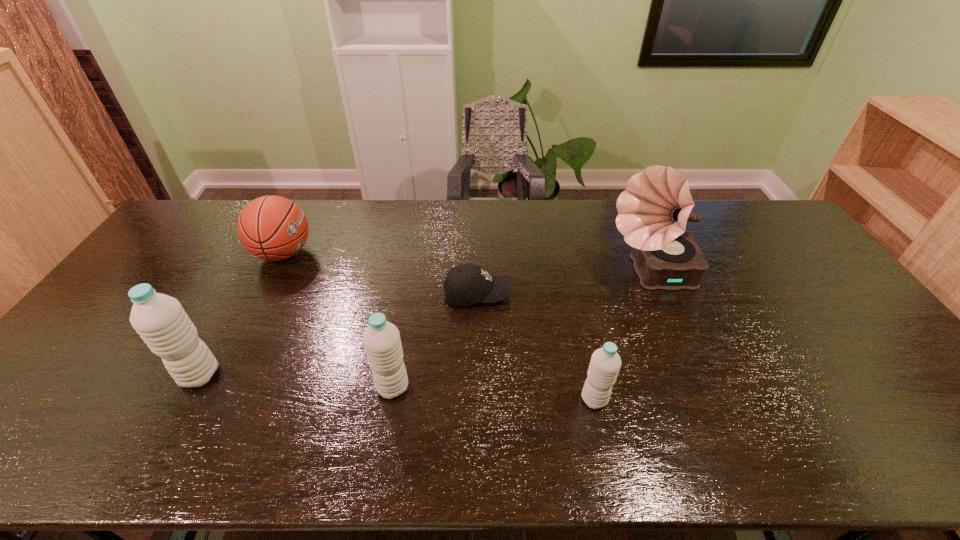
This screenshot has height=540, width=960. Find the location of `free region that satisfies the following two spatial constraints: 1. on the logo side of the second object from right to left; 2. on the right side of the basketball`. free region that satisfies the following two spatial constraints: 1. on the logo side of the second object from right to left; 2. on the right side of the basketball is located at coordinates (209, 399).

In order to click on free spot that satisfies the following two spatial constraints: 1. on the logo side of the fourth object from right to left; 2. on the right side of the basketball in this screenshot , I will do `click(216, 387)`.

I want to click on vacant region that satisfies the following two spatial constraints: 1. on the back side of the second water bottle from left to right; 2. on the logo side of the basketball, so click(x=415, y=253).

Image resolution: width=960 pixels, height=540 pixels. I want to click on vacant space that satisfies the following two spatial constraints: 1. on the logo side of the second tallest water bottle; 2. on the left side of the basketball, so click(216, 387).

The height and width of the screenshot is (540, 960). Identify the location of free point that satisfies the following two spatial constraints: 1. on the logo side of the basketball; 2. on the back side of the second water bottle from right to left. (216, 387).